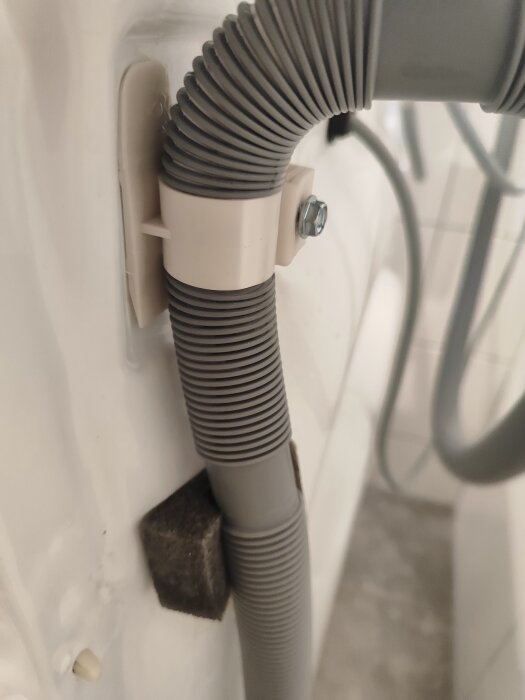
Locate an element on the screen. cord is located at coordinates [487, 474].